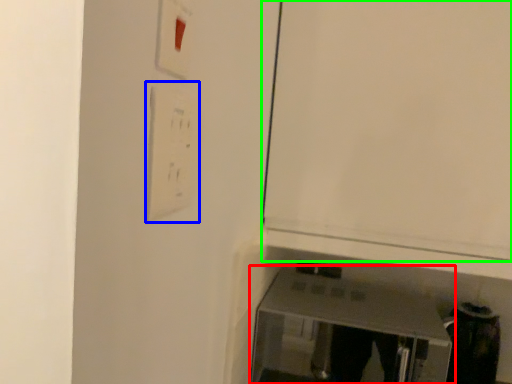
Question: Which object is positioned farthest from furniture (highlighted by a red box)? Select from light switch (highlighted by a blue box) and door (highlighted by a green box).

Choices:
 (A) light switch
 (B) door

Answer: (A)